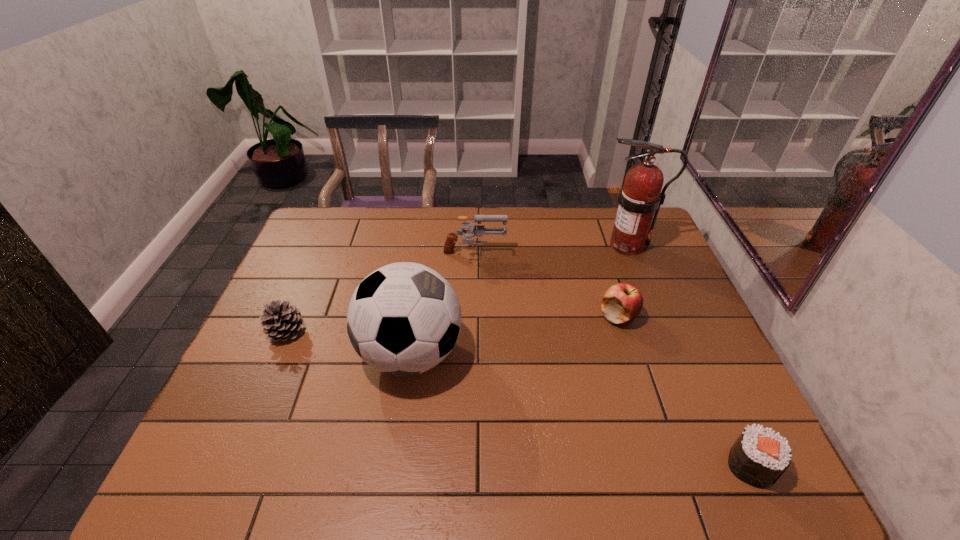
This screenshot has width=960, height=540. I want to click on vacant area in the image that satisfies the following two spatial constraints: 1. at the nozzle of the tallest object; 2. on the right side of the sushi, so click(715, 465).

Where is `free point that satisfies the following two spatial constraints: 1. at the barrel end of the fourth shortest object; 2. on the front side of the pinecone`? Image resolution: width=960 pixels, height=540 pixels. free point that satisfies the following two spatial constraints: 1. at the barrel end of the fourth shortest object; 2. on the front side of the pinecone is located at coordinates (473, 332).

At what (x,y) coordinates should I click in order to perform the action: click on free point that satisfies the following two spatial constraints: 1. at the nozzle of the fire extinguisher; 2. on the right side of the sushi. Please return your answer as a coordinate pair (x, y). The width and height of the screenshot is (960, 540). Looking at the image, I should click on (715, 465).

At what (x,y) coordinates should I click in order to perform the action: click on vacant space that satisfies the following two spatial constraints: 1. on the front side of the apple; 2. on the main logo of the soccer ball. Please return your answer as a coordinate pair (x, y). Image resolution: width=960 pixels, height=540 pixels. Looking at the image, I should click on (630, 354).

You are a GUI agent. You are given a task and a screenshot of the screen. Output one action in this format:
    pyautogui.click(x=<x>, y=<y>)
    Task: Click on the vacant area that satisfies the following two spatial constraints: 1. on the main logo of the second tallest object; 2. on the right side of the shortest object
    The height and width of the screenshot is (540, 960).
    Given the screenshot: What is the action you would take?
    pyautogui.click(x=395, y=465)

Locate an element on the screen. The width and height of the screenshot is (960, 540). free space that satisfies the following two spatial constraints: 1. at the nozzle of the nearest object; 2. on the left side of the tallest object is located at coordinates (715, 465).

This screenshot has height=540, width=960. In order to click on vacant space that satisfies the following two spatial constraints: 1. on the back side of the sushi; 2. at the nozzle of the tallest object in this screenshot , I will do `click(649, 246)`.